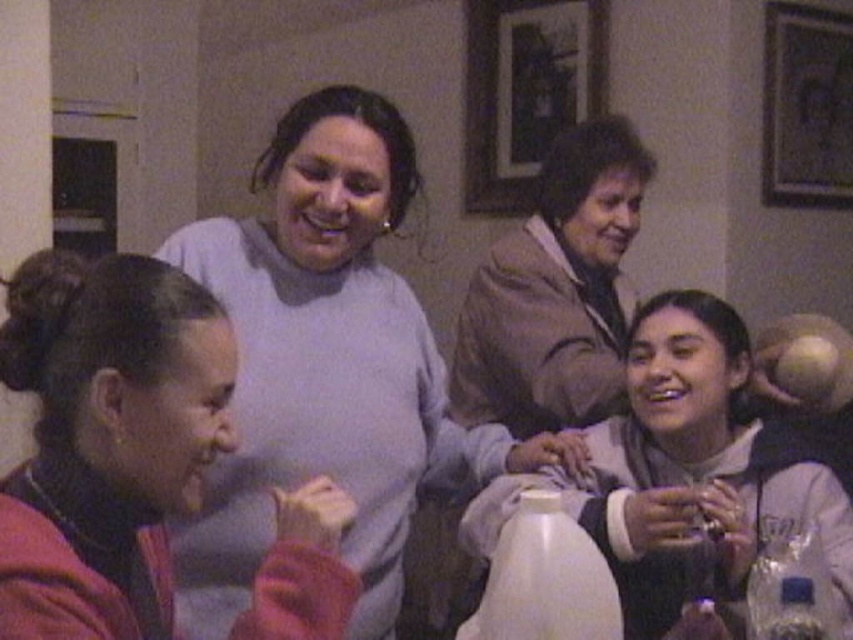
Is matte pink hoodie at lower left thinner than wooden picture frame at upper center?

Yes.

Can you confirm if matte pink hoodie at lower left is taller than wooden picture frame at upper center?

No.

Which is behind, point (181, 401) or point (469, 74)?

Point (469, 74)

I want to click on matte pink hoodie at lower left, so click(x=106, y=440).

Image resolution: width=853 pixels, height=640 pixels. What do you see at coordinates (521, 93) in the screenshot?
I see `wooden picture frame at upper center` at bounding box center [521, 93].

Which of these two, wooden picture frame at upper center or wooden picture frame at upper right, stands shorter?

With less height is wooden picture frame at upper right.

Does point (572, 4) come behind point (838, 148)?

Yes, it is behind point (838, 148).

Image resolution: width=853 pixels, height=640 pixels. I want to click on wooden picture frame at upper center, so click(x=521, y=93).

Can you confirm if wooden picture frame at upper center is positioned above white glossy bottle at lower center?

Yes.

Measure the distance between point (x=537, y=28) and camera.

3.19 meters

I want to click on wooden picture frame at upper center, so click(x=521, y=93).